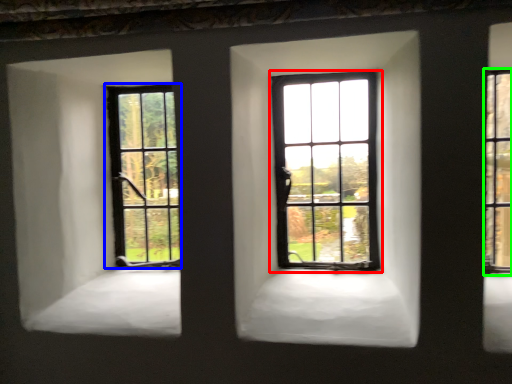
Question: Which object is positioned closest to window (highlighted by a red box)? Select from window (highlighted by a blue box) and window (highlighted by a green box).

Choices:
 (A) window
 (B) window

Answer: (A)